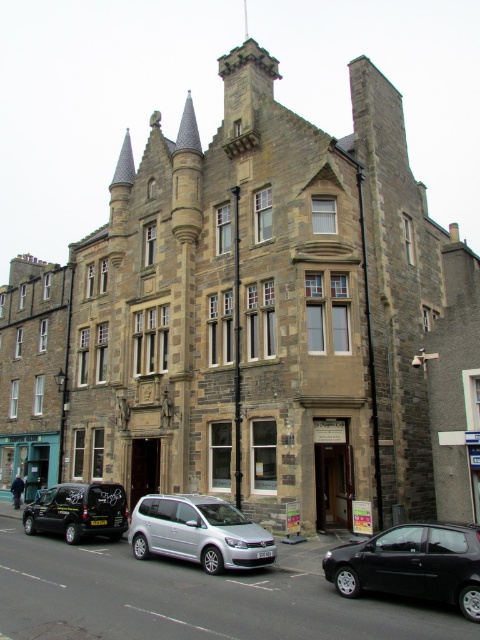
Question: Is the position of silver metallic van at center more distant than that of black matte van at lower left?

Choices:
 (A) no
 (B) yes

Answer: (A)

Question: Based on their relative distances, which object is farther from the black matte hatchback at lower right?

Choices:
 (A) silver metallic van at center
 (B) black matte van at lower left

Answer: (B)

Question: In this image, where is black matte hatchback at lower right located relative to silver metallic van at center?

Choices:
 (A) above
 (B) below

Answer: (A)

Question: Among these points, which one is nearest to the camera?

Choices:
 (A) (69, 486)
 (B) (183, 534)
 (C) (424, 557)

Answer: (C)

Question: Among these points, which one is nearest to the camera?

Choices:
 (A) (166, 508)
 (B) (91, 512)
 (C) (420, 541)

Answer: (C)

Question: From the image, what is the correct spatial relationship of silver metallic van at center in relation to black matte van at lower left?

Choices:
 (A) left
 (B) right

Answer: (B)